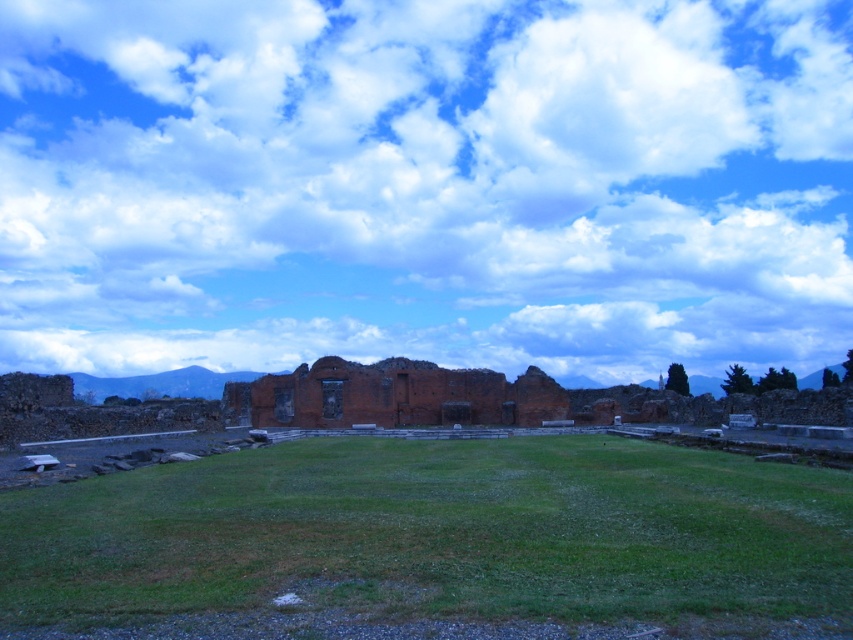
Is point (426, 86) closer to camera compared to point (149, 579)?

No, it is not.

The image size is (853, 640). I want to click on white fluffy cloud at upper center, so click(x=424, y=184).

Between point (9, 620) and point (260, 408), which one is positioned behind?

Point (260, 408)

Does point (308, 566) come behind point (345, 368)?

That is False.

Is point (378, 525) in front of point (264, 394)?

That is True.

You are a GUI agent. You are given a task and a screenshot of the screen. Output one action in this format:
    pyautogui.click(x=<x>, y=<y>)
    Task: Click on the green grassy field at center
    
    Given the screenshot: What is the action you would take?
    pyautogui.click(x=436, y=536)

Is point (730, 348) closer to viewer compared to point (480, 381)?

No, it is behind (480, 381).

Is white fluffy cloud at upper center thinner than brick wall at center?

Incorrect, white fluffy cloud at upper center's width is not less than brick wall at center's.

Image resolution: width=853 pixels, height=640 pixels. I want to click on white fluffy cloud at upper center, so (x=424, y=184).